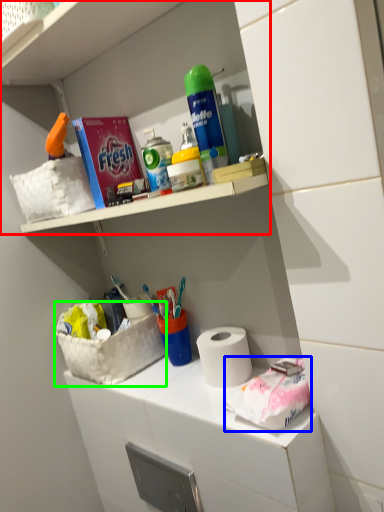
Question: Which object is the closest to the shelf (highlighted by a red box)? Choose among these: material (highlighted by a blue box) or basket (highlighted by a green box).

Choices:
 (A) material
 (B) basket

Answer: (B)